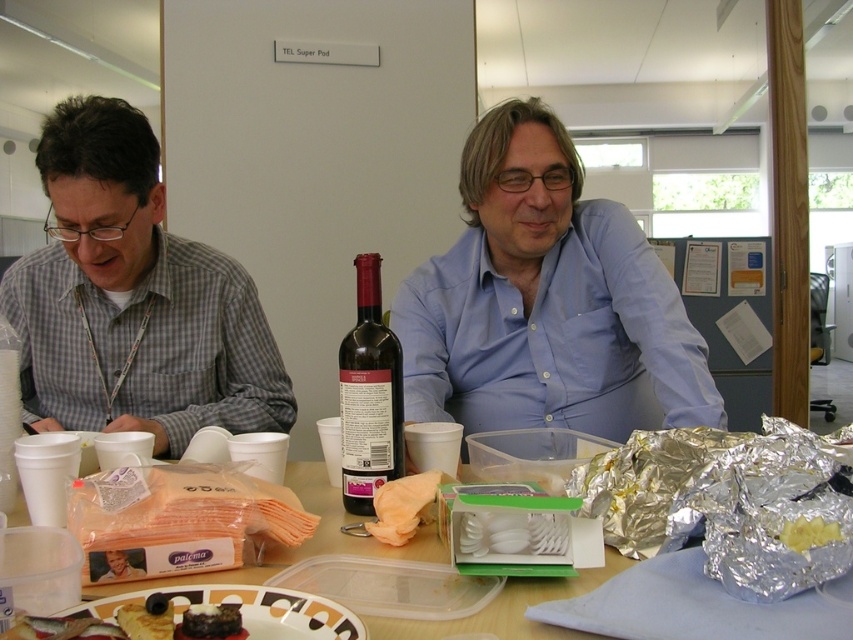
You are a fashion designer observing two shirts worn by the same person in the image. The shirts are the matte black shirt at left and the gray checkered shirt at left. Which shirt has a larger size?

The matte black shirt at left has a larger size compared to the gray checkered shirt at left.

You are a photographer trying to capture a clear shot of the gray checkered shirt at left and the brown crumbly cake at center. If the camera frame can only accommodate one of them fully, which object should you prioritize to ensure it fits within the frame?

The gray checkered shirt at left should be prioritized as it might be wider than the brown crumbly cake at center, ensuring it fits better within the camera frame.

You are a photographer trying to capture a candid shot of the two people at the table. To ensure the gray checkered shirt at left and the dark red glass bottle at center are both in focus, which object should you adjust your camera focus on first?

The gray checkered shirt at left is taller than the dark red glass bottle at center, so you should focus on the gray checkered shirt at left first to ensure both are in focus.